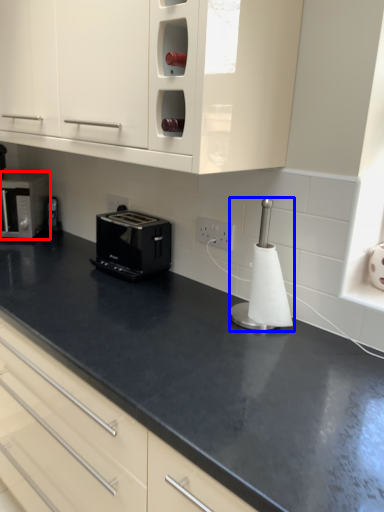
Question: Which point is closer to the camera, home appliance (highlighted by a red box) or appliance (highlighted by a blue box)?

Choices:
 (A) home appliance
 (B) appliance

Answer: (B)